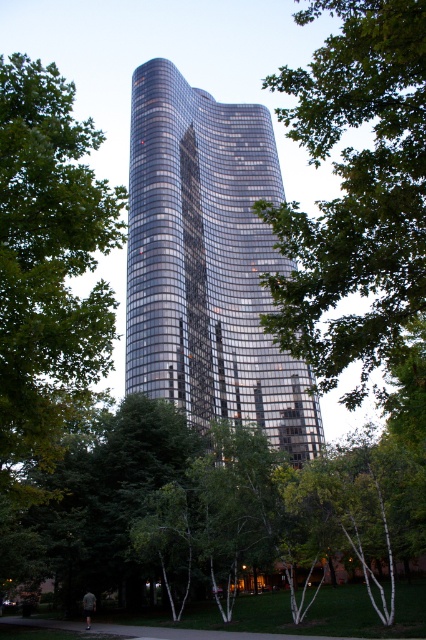
What are the coordinates of the glossy glass tower at center?

The glossy glass tower at center is located at coordinates point [207,262].

You are an architect analyzing the image of a modern skyscraper and a tree. Based on the scene, which object is smaller in size between the glossy glass tower at center and the green leafy tree at center?

The glossy glass tower at center is smaller in size compared to the green leafy tree at center.

You are standing at the base of the skyscraper in the image. Looking up, you notice a point marked at coordinates [356,193]. What object is located at that point?

The point at [356,193] indicates a green leafy tree at center.